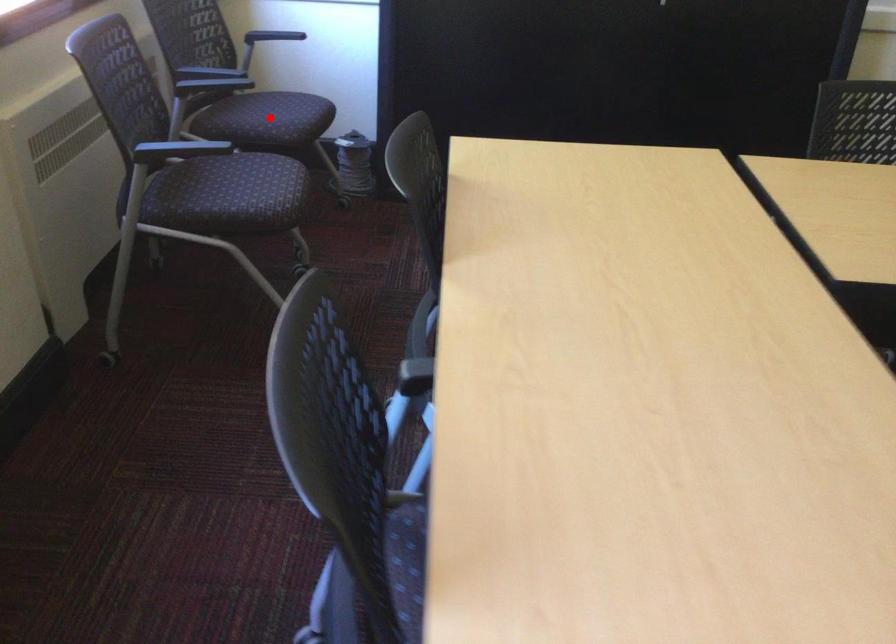
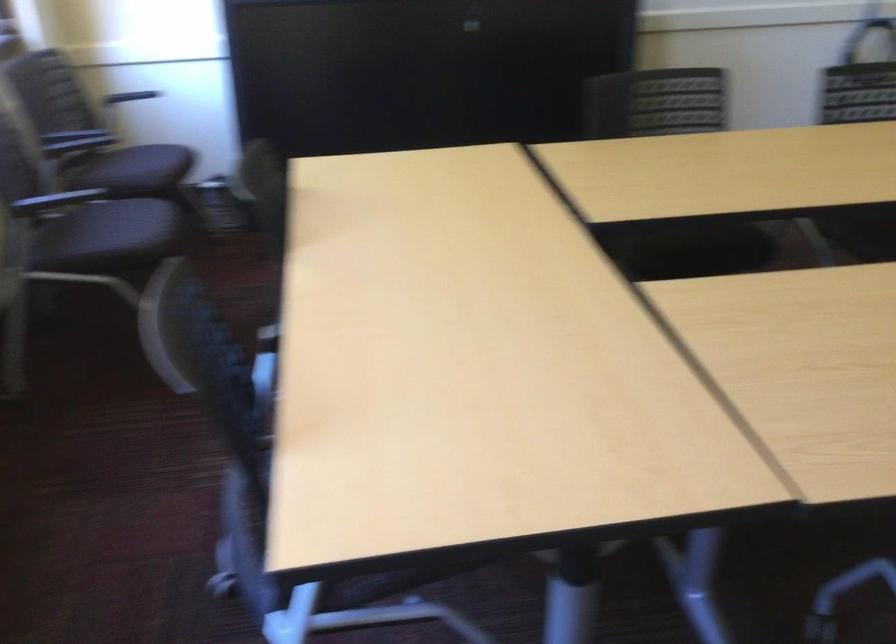
In the second image, find the point that corresponds to the highlighted location in the first image.

(135, 169)